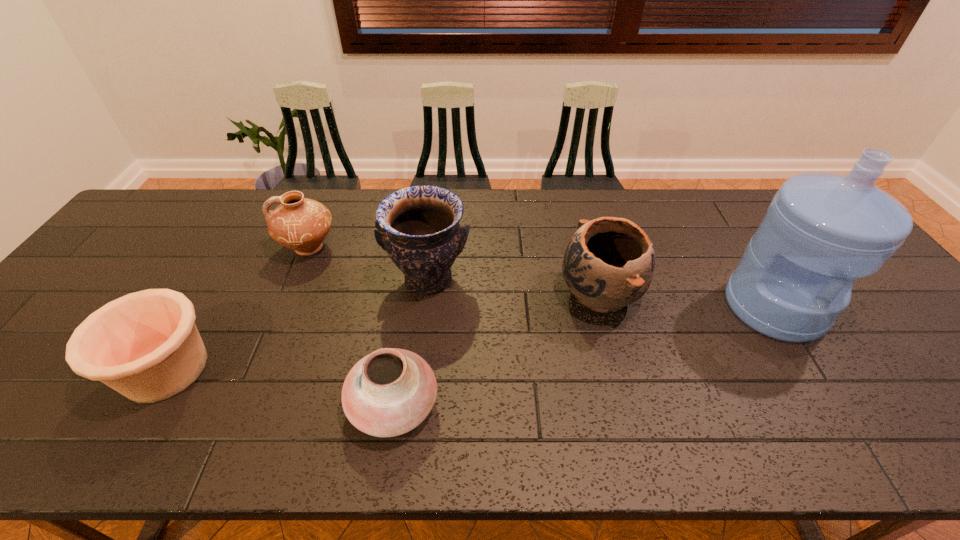
Locate an element on the screen. This screenshot has width=960, height=540. free space between the rightmost object and the second object from left to right is located at coordinates (541, 277).

The height and width of the screenshot is (540, 960). Find the location of `object that is the fourth closest to the fifth object from left to right`. object that is the fourth closest to the fifth object from left to right is located at coordinates (302, 224).

Locate which object ranks second in proximity to the fifth object from right to left. Please provide its 2D coordinates. Your answer should be formatted as a tuple, i.e. [(x, y)], where the tuple contains the x and y coordinates of a point satisfying the conditions above.

[(145, 345)]

Identify which pottery is the fourth closest to the leftmost object. Please provide its 2D coordinates. Your answer should be formatted as a tuple, i.e. [(x, y)], where the tuple contains the x and y coordinates of a point satisfying the conditions above.

[(608, 264)]

Identify which pottery is located as the fifth nearest to the water jug. Please provide its 2D coordinates. Your answer should be formatted as a tuple, i.e. [(x, y)], where the tuple contains the x and y coordinates of a point satisfying the conditions above.

[(145, 345)]